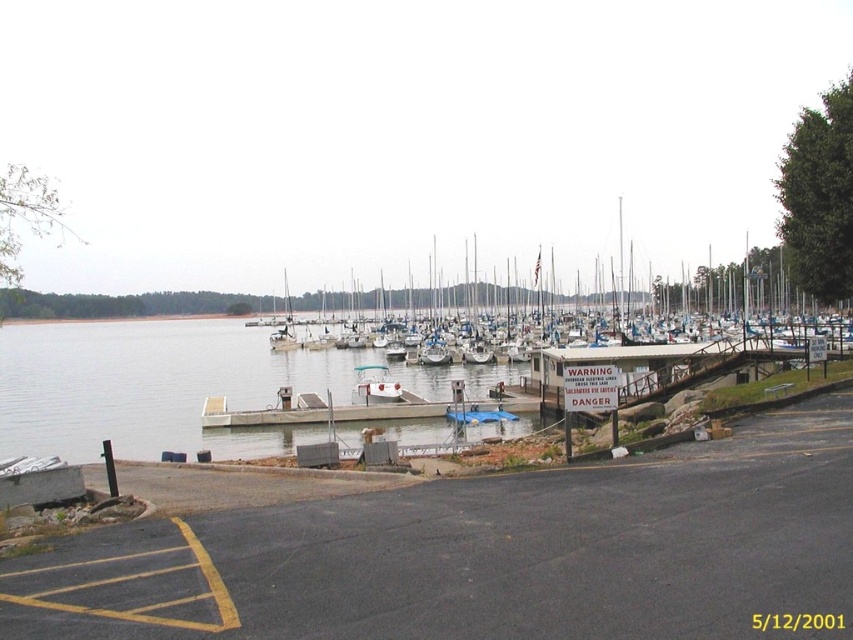
You are a delivery drone flying over the marina scene. Your GPS coordinates show that you need to land at the black asphalt parking lot at lower left. According to the map, where should you aim to land?

The black asphalt parking lot at lower left is located at the coordinates point (494,554), so you should aim to land there.

You are a delivery driver who needs to park your truck in the black asphalt parking lot at lower left. However, your truck is as large as the white matte boats at center. Will your truck fit in the parking spot?

The black asphalt parking lot at lower left is smaller than the white matte boats at center, so the truck will not fit in the parking spot since it is the same size as the boats which are larger than the parking area.